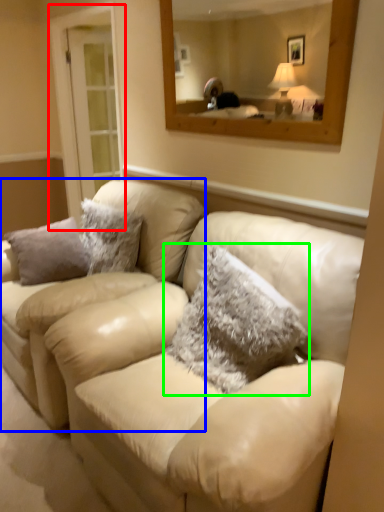
Question: Estimate the real-world distances between objects in this image. Which object is closer to glass door (highlighted by a red box), couch (highlighted by a blue box) or pillow (highlighted by a green box)?

Choices:
 (A) couch
 (B) pillow

Answer: (A)